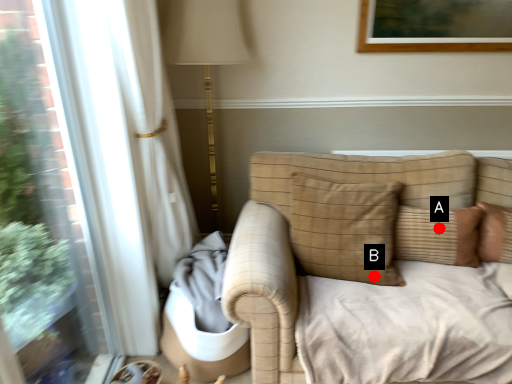
Question: Two points are circled on the image, labeled by A and B beside each circle. Which point appears closest to the camera in this image?

Choices:
 (A) A is closer
 (B) B is closer

Answer: (B)